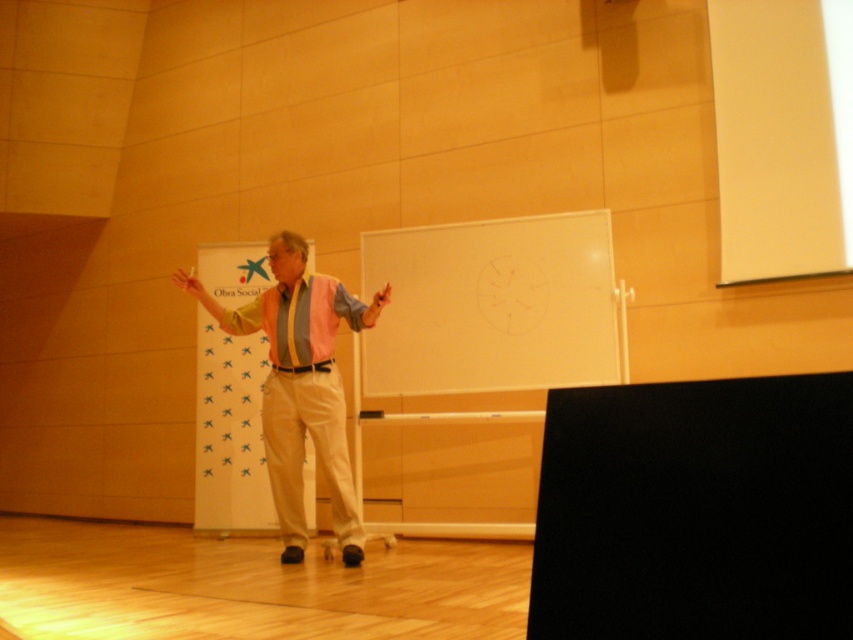
Does white matte board at center have a lesser width compared to pink fabric dress shirt at center?

In fact, white matte board at center might be wider than pink fabric dress shirt at center.

Is white matte board at center wider than pink fabric dress shirt at center?

Yes.

Does point (412, 353) lie behind point (242, 307)?

Yes, it is.

Find the location of `white matte board at center`. white matte board at center is located at coordinates (492, 307).

Is white matte projection screen at upper right taller than pink fabric shirt at center?

In fact, white matte projection screen at upper right may be shorter than pink fabric shirt at center.

The image size is (853, 640). What are the coordinates of `white matte projection screen at upper right` in the screenshot? It's located at (782, 134).

Where is `white matte projection screen at upper right`? Image resolution: width=853 pixels, height=640 pixels. white matte projection screen at upper right is located at coordinates (782, 134).

Is point (292, 342) behind point (277, 289)?

No, (292, 342) is in front of (277, 289).

This screenshot has height=640, width=853. In order to click on pink fabric shirt at center in this screenshot , I will do `click(300, 385)`.